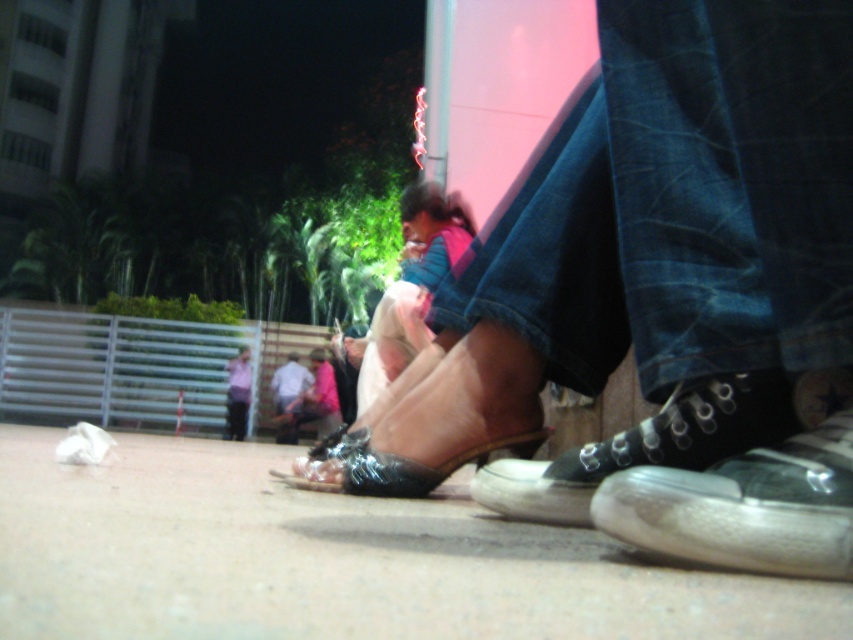
Question: Which object appears closest to the camera in this image?

Choices:
 (A) light blue shirt at lower center
 (B) smooth concrete pavement at lower center
 (C) shiny black sandal at center
 (D) pink fabric shirt at lower center

Answer: (B)

Question: Can you confirm if black canvas shoe at lower right is smaller than pink fabric shirt at lower center?

Choices:
 (A) yes
 (B) no

Answer: (A)

Question: Where is smooth concrete pavement at lower center located in relation to black canvas shoe at lower right in the image?

Choices:
 (A) left
 (B) right

Answer: (A)

Question: Which point appears closest to the camera in this image?

Choices:
 (A) (248, 392)
 (B) (582, 492)
 (C) (645, 604)
 (D) (370, 420)

Answer: (C)

Question: Is smooth concrete pavement at lower center positioned at the back of black canvas shoe at lower right?

Choices:
 (A) no
 (B) yes

Answer: (A)

Question: Among these objects, which one is nearest to the camera?

Choices:
 (A) pink fabric shirt at lower center
 (B) light blue shirt at lower center
 (C) black canvas shoe at lower right
 (D) white canvas sneaker at lower right

Answer: (D)